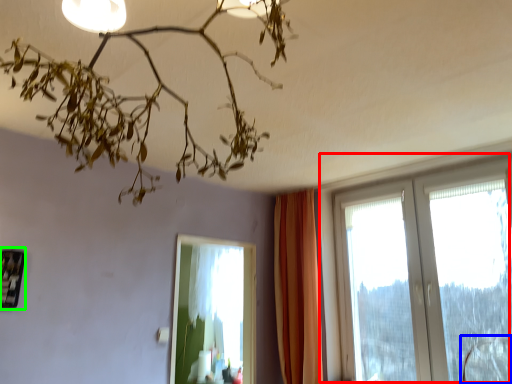
Question: Which object is positioned closest to window (highlighted by a red box)? Select from swivel chair (highlighted by a blue box) and picture frame (highlighted by a green box).

Choices:
 (A) swivel chair
 (B) picture frame

Answer: (A)